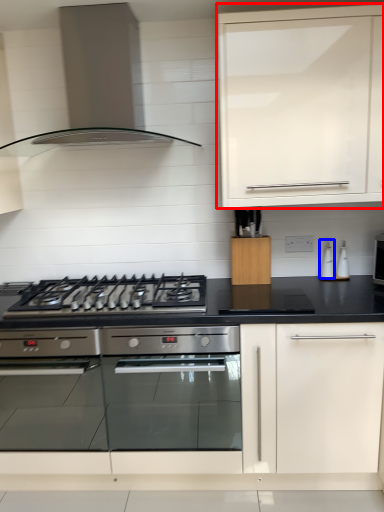
Question: Among these objects, which one is farthest to the camera, cabinetry (highlighted by a red box) or appliance (highlighted by a blue box)?

Choices:
 (A) cabinetry
 (B) appliance

Answer: (B)